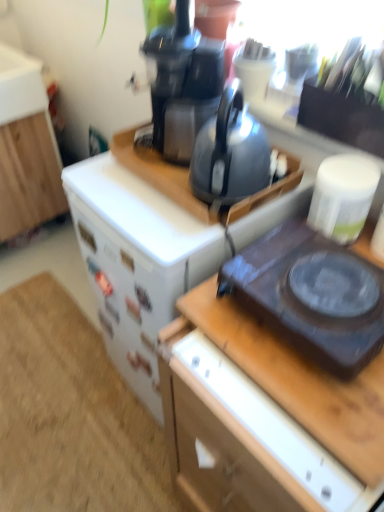
Find the location of a particular element. vacant area situated to the left side of matte black kettle at center is located at coordinates (144, 210).